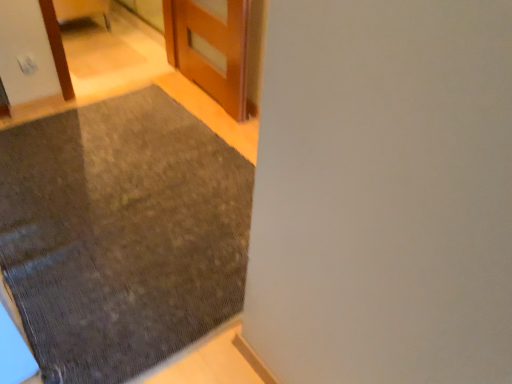
Question: Is wooden door at upper center in front of textured gray mat at lower left?

Choices:
 (A) yes
 (B) no

Answer: (B)

Question: Is the position of wooden door at upper center more distant than that of textured gray mat at lower left?

Choices:
 (A) no
 (B) yes

Answer: (B)

Question: Does wooden door at upper center appear on the left side of textured gray mat at lower left?

Choices:
 (A) yes
 (B) no

Answer: (B)

Question: From a real-world perspective, is wooden door at upper center located beneath textured gray mat at lower left?

Choices:
 (A) yes
 (B) no

Answer: (B)

Question: From the image's perspective, does wooden door at upper center appear higher than textured gray mat at lower left?

Choices:
 (A) no
 (B) yes

Answer: (B)

Question: Is wooden door at upper center at the right side of textured gray mat at lower left?

Choices:
 (A) yes
 (B) no

Answer: (A)

Question: Does textured gray mat at lower left have a larger size compared to wooden door at upper center?

Choices:
 (A) yes
 (B) no

Answer: (A)

Question: Is textured gray mat at lower left placed right next to wooden door at upper center?

Choices:
 (A) yes
 (B) no

Answer: (B)

Question: Considering the relative positions of textured gray mat at lower left and wooden door at upper center in the image provided, is textured gray mat at lower left in front of wooden door at upper center?

Choices:
 (A) yes
 (B) no

Answer: (A)

Question: From a real-world perspective, is textured gray mat at lower left positioned under wooden door at upper center based on gravity?

Choices:
 (A) no
 (B) yes

Answer: (B)

Question: Does textured gray mat at lower left have a greater width compared to wooden door at upper center?

Choices:
 (A) no
 (B) yes

Answer: (B)

Question: Can you confirm if textured gray mat at lower left is thinner than wooden door at upper center?

Choices:
 (A) yes
 (B) no

Answer: (B)

Question: From a real-world perspective, is textured gray mat at lower left physically located above or below wooden door at upper center?

Choices:
 (A) below
 (B) above

Answer: (A)